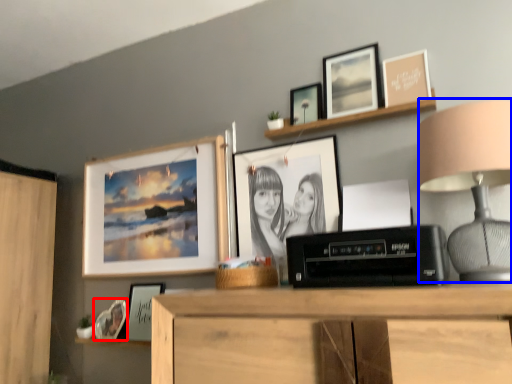
Question: Which point is further to the camera, picture frame (highlighted by a red box) or table lamp (highlighted by a blue box)?

Choices:
 (A) picture frame
 (B) table lamp

Answer: (A)